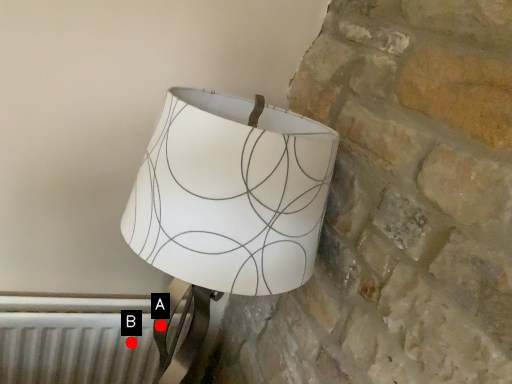
Question: Two points are circled on the image, labeled by A and B beside each circle. Which point is farther to the camera?

Choices:
 (A) A is further
 (B) B is further

Answer: (B)